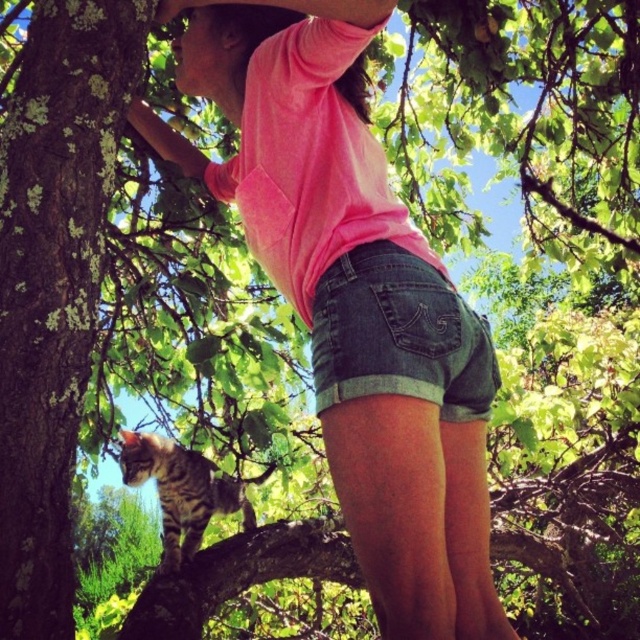
You are a photographer trying to capture a candid shot of the tabby fur cat at center and the denim shorts at center. Since you want the cat to be on the left side of the photo, should you position yourself to the left or right of the scene?

You should position yourself to the right of the scene because the denim shorts at center are already to the right of the tabby fur cat at center. This way, when you take the photo, the cat will naturally appear on the left side.

You are a photographer trying to capture a closeup of the person in the tree. You need to focus on the denim shorts at center and the tabby fur cat at center. Which object is narrower in width?

The denim shorts at center is narrower in width than the tabby fur cat at center.

Based on the photo, you are a photographer trying to capture a photo of the denim shorts at center and the tabby fur cat at center in the tree scene. Which object should you focus on first if you want to prioritize the closer one to the camera?

The denim shorts at center has a lesser height compared to the tabby fur cat at center, so the denim shorts at center is closer to the camera and should be focused on first.